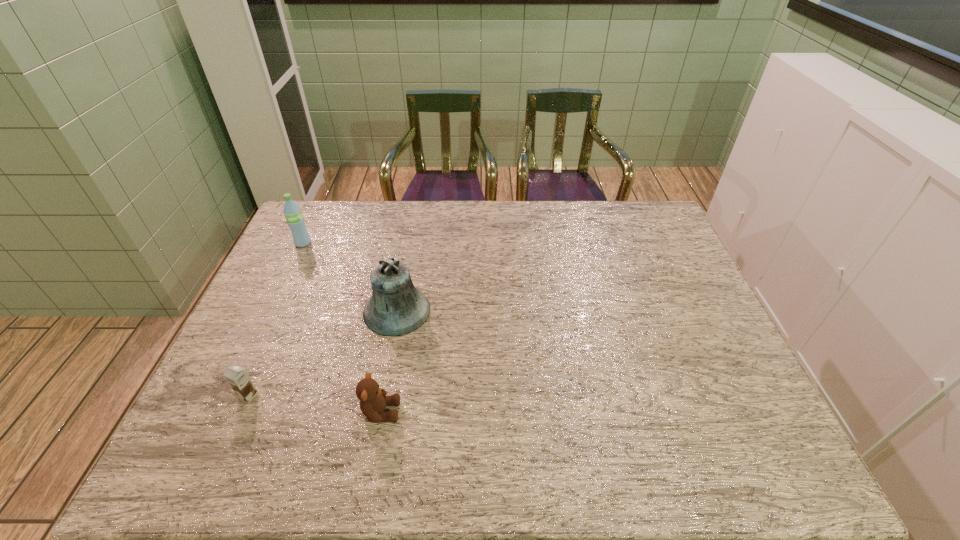
Where is `free space in the image that satisfies the following two spatial constraints: 1. on the front side of the chocolate milk; 2. on the left side of the water bottle`? The width and height of the screenshot is (960, 540). free space in the image that satisfies the following two spatial constraints: 1. on the front side of the chocolate milk; 2. on the left side of the water bottle is located at coordinates (231, 395).